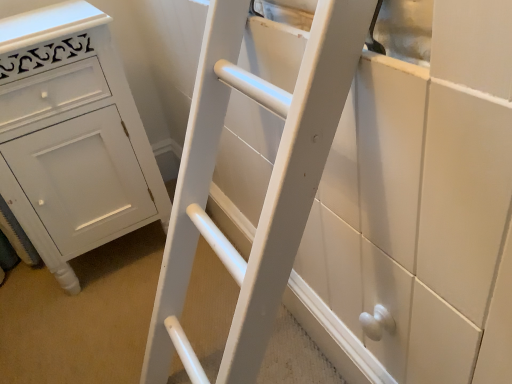
Question: Relative to white matte ladder at center, is white painted wood chest of drawers at left in front or behind?

Choices:
 (A) behind
 (B) front

Answer: (A)

Question: Considering the positions of white painted wood chest of drawers at left and white matte ladder at center in the image, is white painted wood chest of drawers at left taller or shorter than white matte ladder at center?

Choices:
 (A) short
 (B) tall

Answer: (B)

Question: Is white painted wood chest of drawers at left spatially inside white matte ladder at center, or outside of it?

Choices:
 (A) inside
 (B) outside

Answer: (B)

Question: From a real-world perspective, relative to white painted wood chest of drawers at left, is white matte ladder at center vertically above or below?

Choices:
 (A) below
 (B) above

Answer: (A)

Question: In the image, is white matte ladder at center positioned in front of or behind white painted wood chest of drawers at left?

Choices:
 (A) front
 (B) behind

Answer: (A)

Question: In terms of height, does white matte ladder at center look taller or shorter compared to white painted wood chest of drawers at left?

Choices:
 (A) tall
 (B) short

Answer: (B)

Question: Does point (210, 3) appear closer or farther from the camera than point (113, 135)?

Choices:
 (A) closer
 (B) farther

Answer: (A)